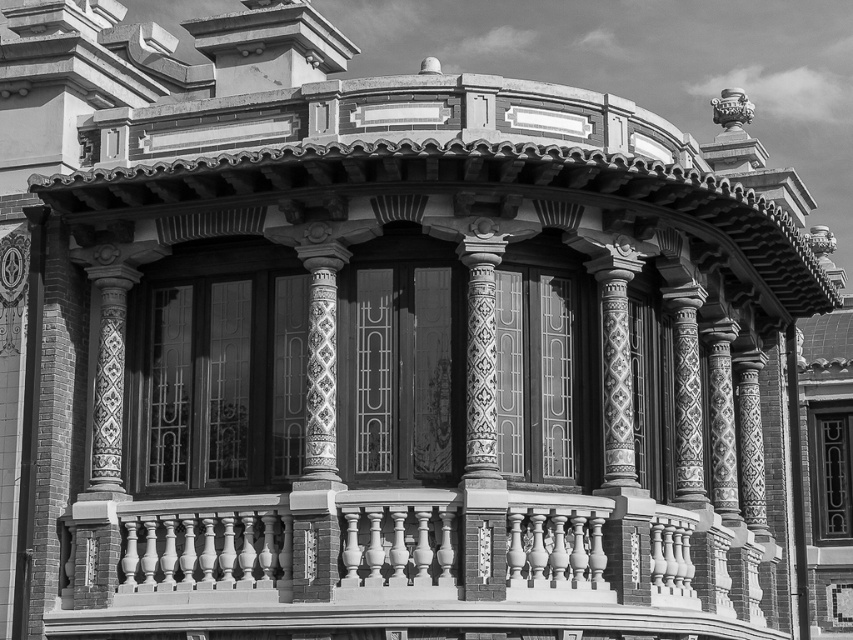
You are standing in front of the building and want to touch both the smooth white balustrade at lower center and the decorative tile column at center. Which object will you reach first?

The smooth white balustrade at lower center is closer to the viewer than the decorative tile column at center, so you will reach the smooth white balustrade at lower center first.

You are standing at the base of the building and looking up at the columns and balustrade. There are two points marked on the facade. One is at coordinates point (730,621) and the other at point (334,401). Which of these points is closer to the viewer?

Point (334,401) is closer to the viewer because it is in front of point (730,621).